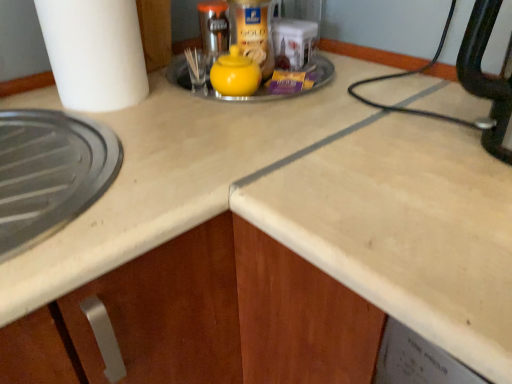
Question: From a real-world perspective, is yellow matte sugar bowl at center under yellow matte teapot at center?

Choices:
 (A) no
 (B) yes

Answer: (B)

Question: From the image's perspective, does yellow matte sugar bowl at center appear higher than yellow matte teapot at center?

Choices:
 (A) yes
 (B) no

Answer: (A)

Question: Does yellow matte sugar bowl at center have a greater height compared to yellow matte teapot at center?

Choices:
 (A) yes
 (B) no

Answer: (B)

Question: Does yellow matte sugar bowl at center have a greater width compared to yellow matte teapot at center?

Choices:
 (A) no
 (B) yes

Answer: (B)

Question: From the image's perspective, is yellow matte sugar bowl at center under yellow matte teapot at center?

Choices:
 (A) yes
 (B) no

Answer: (B)

Question: Is yellow matte sugar bowl at center not close to yellow matte teapot at center?

Choices:
 (A) no
 (B) yes

Answer: (A)

Question: From the image's perspective, is yellow matte sugar bowl at center over white matte paper towel at left?

Choices:
 (A) yes
 (B) no

Answer: (B)

Question: Can you confirm if yellow matte sugar bowl at center is thinner than white matte paper towel at left?

Choices:
 (A) no
 (B) yes

Answer: (A)

Question: Does yellow matte sugar bowl at center have a greater height compared to white matte paper towel at left?

Choices:
 (A) yes
 (B) no

Answer: (B)

Question: Are yellow matte sugar bowl at center and white matte paper towel at left making contact?

Choices:
 (A) yes
 (B) no

Answer: (B)

Question: Is white matte paper towel at left completely or partially inside yellow matte sugar bowl at center?

Choices:
 (A) no
 (B) yes

Answer: (A)

Question: Is yellow matte sugar bowl at center further to camera compared to white matte paper towel at left?

Choices:
 (A) yes
 (B) no

Answer: (A)

Question: Does white matte paper towel at left have a lesser width compared to yellow matte teapot at center?

Choices:
 (A) no
 (B) yes

Answer: (A)